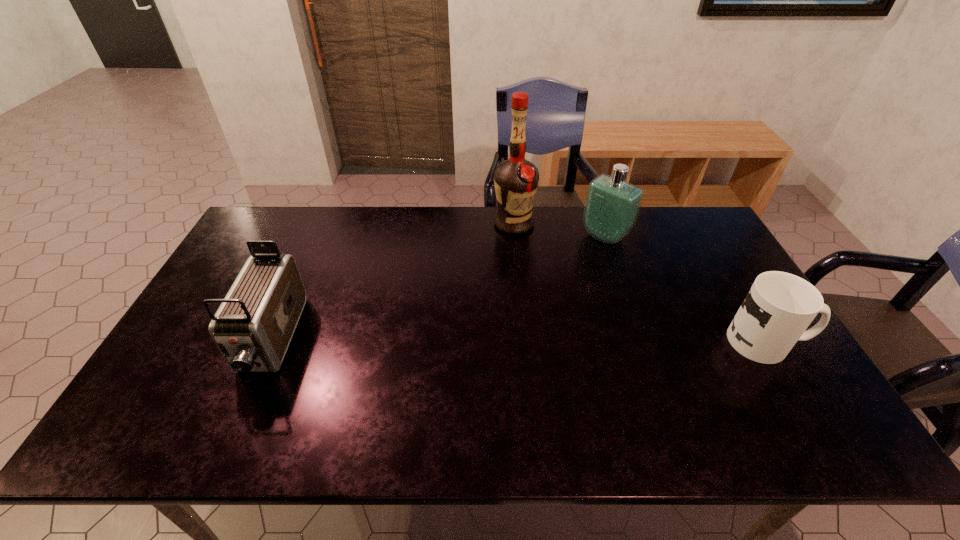
Where is `vacant space on the desktop that is between the camcorder and the rightmost object and is positioned on the front label of the perfume`? vacant space on the desktop that is between the camcorder and the rightmost object and is positioned on the front label of the perfume is located at coordinates (483, 341).

Where is `free space on the desktop that is between the leftmost object and the mug and is positioned on the front and back of the liquor`? free space on the desktop that is between the leftmost object and the mug and is positioned on the front and back of the liquor is located at coordinates (556, 341).